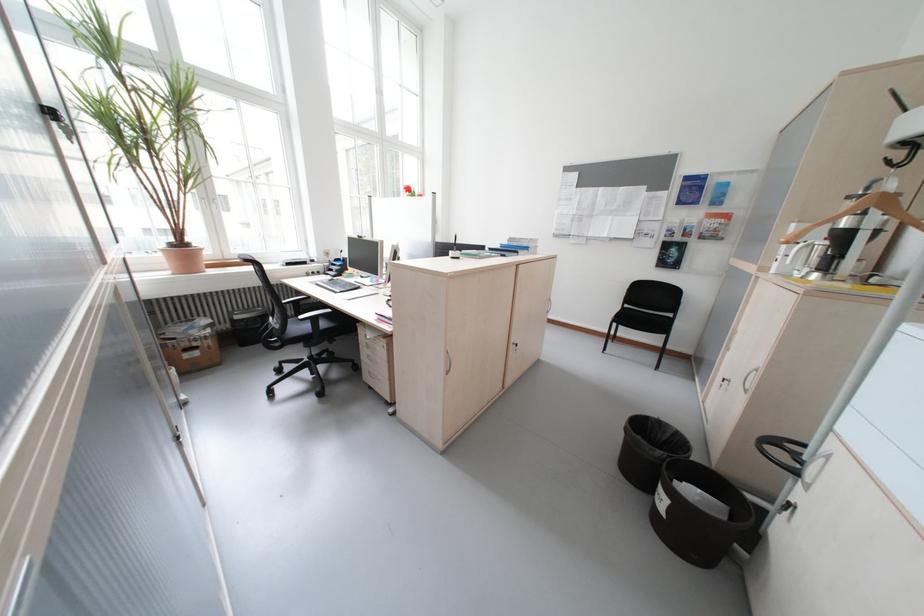
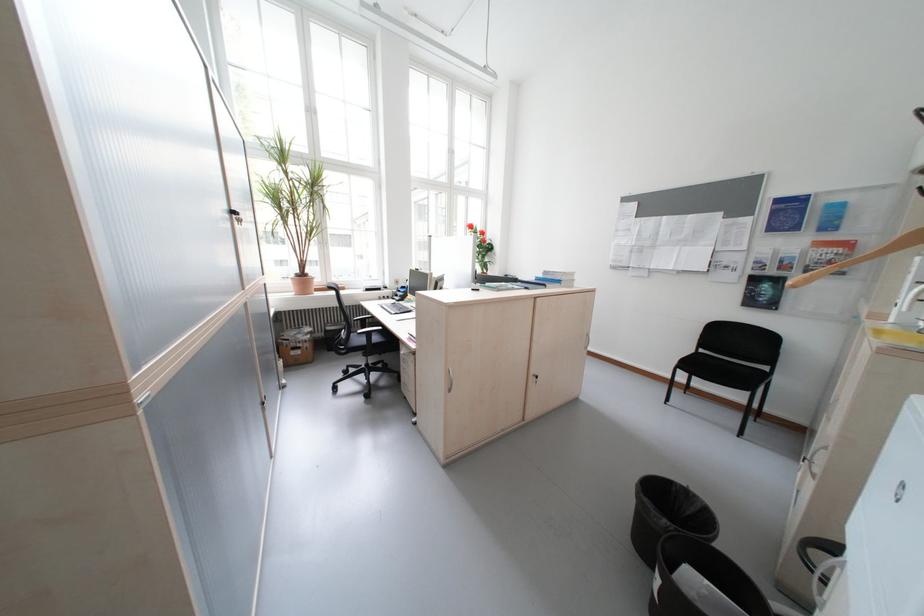
Question: I am providing you with two images of the same scene from different viewpoints. After the viewpoint changes to image2, which objects are now occluded?

Choices:
 (A) metal cabinet lock
 (B) wooden clothes hanger
 (C) silver cabinet handle
 (D) none of these

Answer: (D)